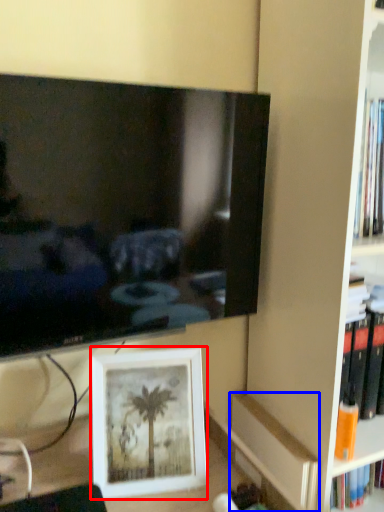
Question: Which object appears closest to the camera in this image, picture frame (highlighted by a red box) or paperback book (highlighted by a blue box)?

Choices:
 (A) picture frame
 (B) paperback book

Answer: (A)